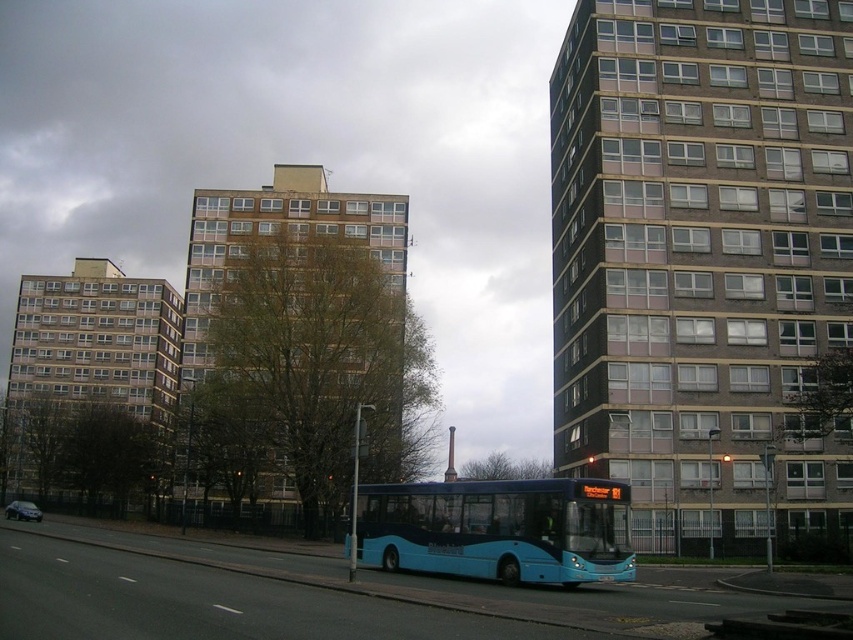
You are a pedestrian standing at the crosswalk near the buildings. You see the blue matte bus at center and the metallic silver car at lower left. Which vehicle is closer to you?

The blue matte bus at center is closer to you because it is positioned in front of the metallic silver car at lower left.

You are a delivery driver who needs to park your blue matte bus at center in a parking lot located 30 meters away from the camera. Can your bus reach the parking lot without any obstacles?

The blue matte bus at center is 28.28 meters away from camera, so yes, the bus can reach the parking lot since it is within the 30 meters distance.